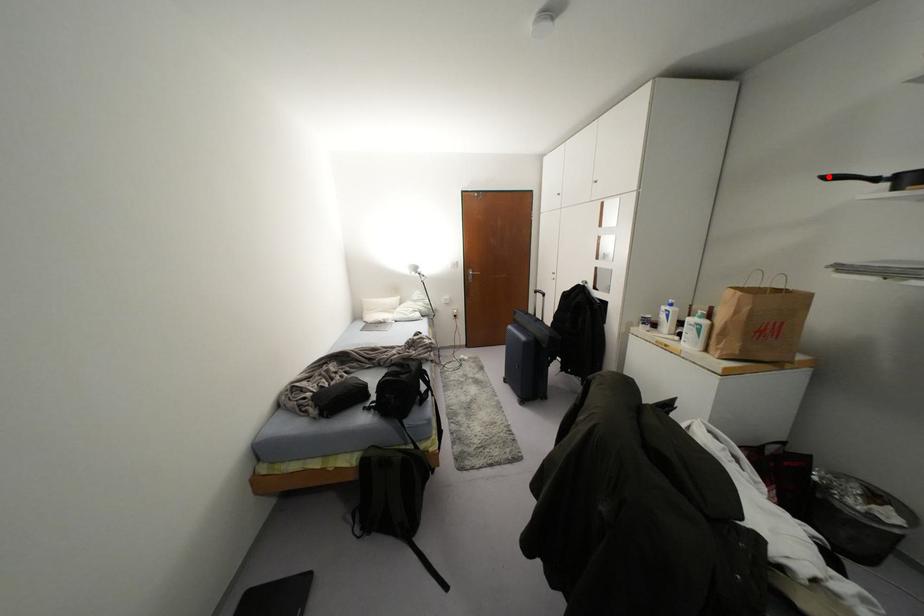
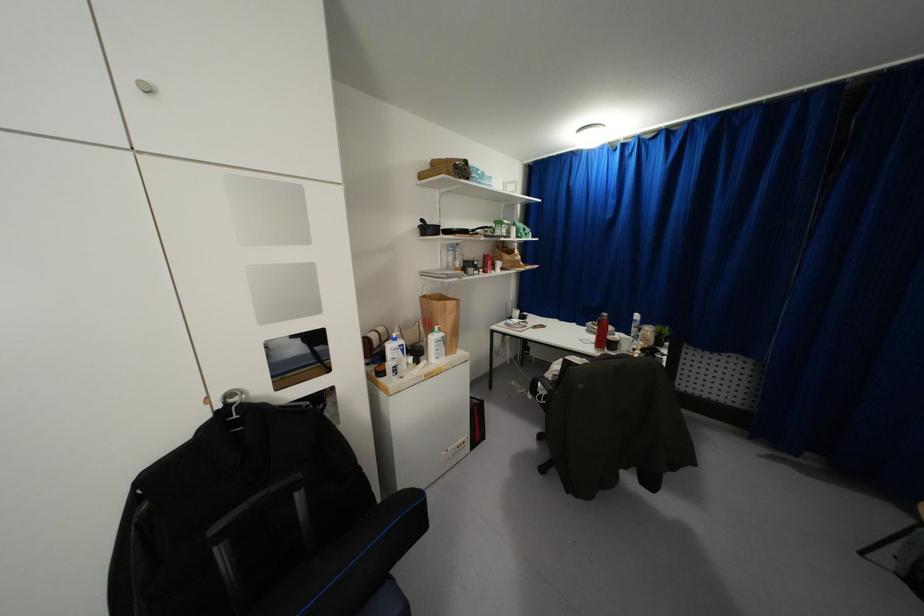
Find the pixel in the second image that matches the highlighted location in the first image.

(421, 220)